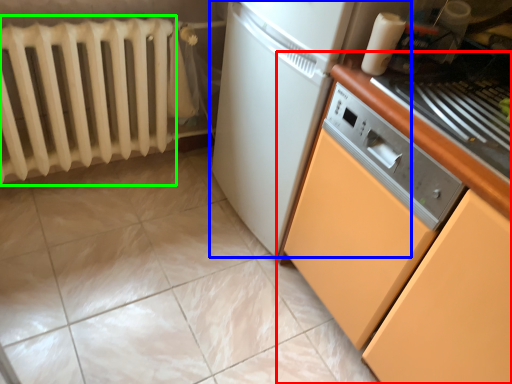
Question: Which object is the farthest from cabinetry (highlighted by a red box)? Choose among these: home appliance (highlighted by a blue box) or radiator (highlighted by a green box).

Choices:
 (A) home appliance
 (B) radiator

Answer: (B)